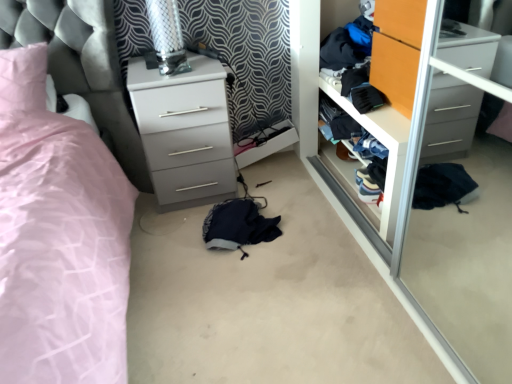
This screenshot has width=512, height=384. What are the coordinates of `vacant space to the right of white glossy chest of drawers at center` in the screenshot? It's located at (274, 186).